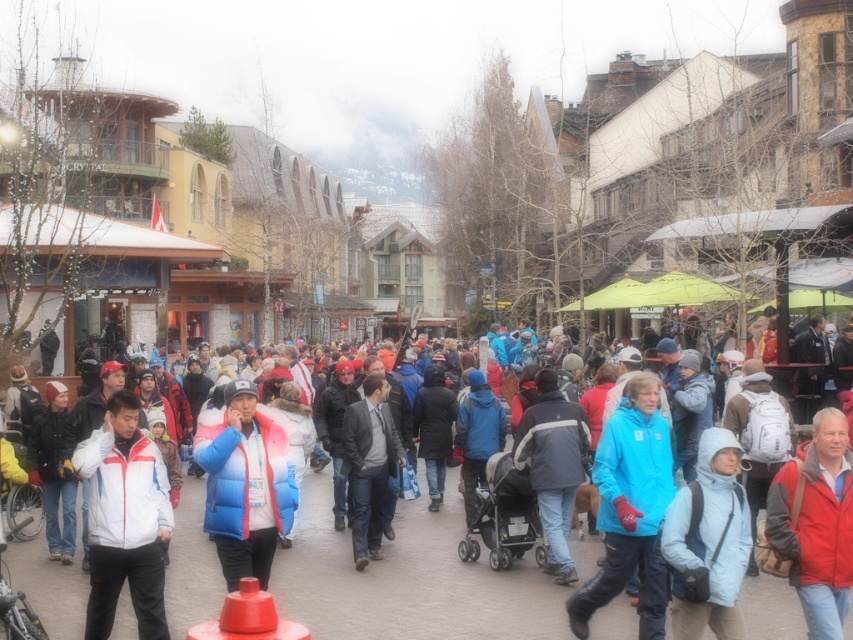
You are a photographer trying to capture both the white matte jacket at center and the dark gray suit at center in a single frame. Given their sizes, which one will appear bigger in the photo?

The white matte jacket at center will appear bigger in the photo because it is larger in size than the dark gray suit at center.